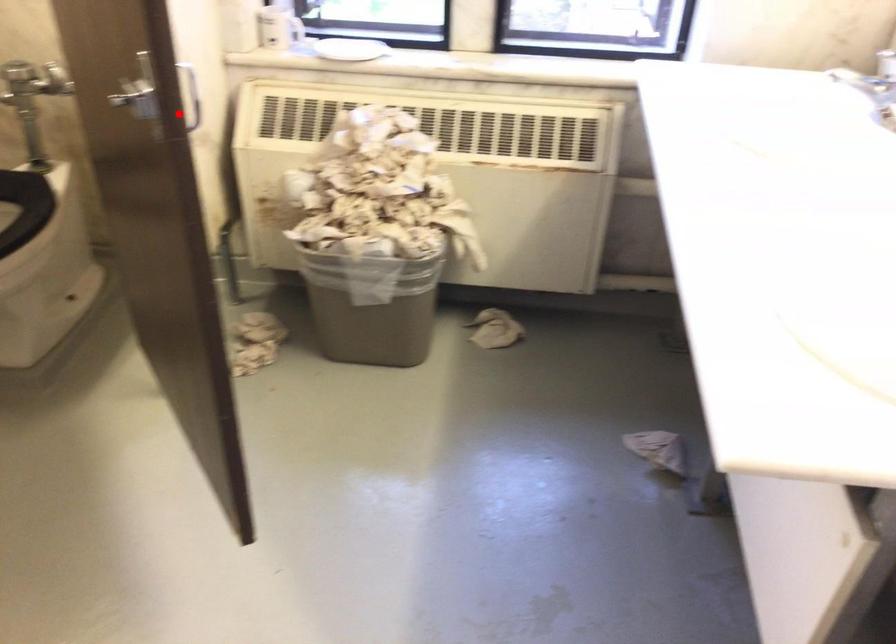
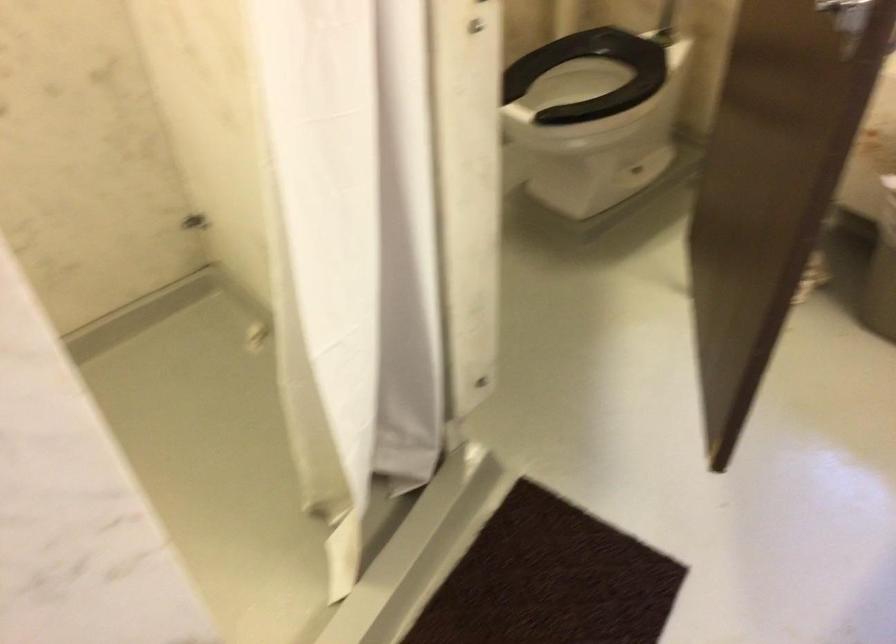
The point at the highlighted location is marked in the first image. Where is the corresponding point in the second image?

(849, 14)